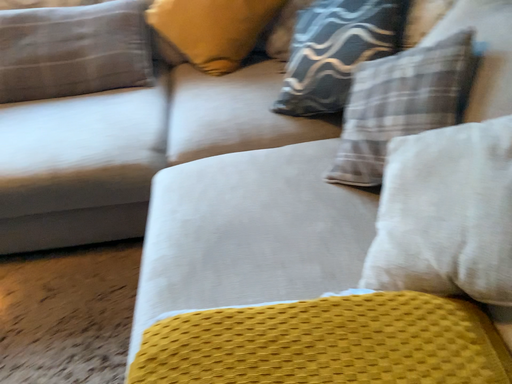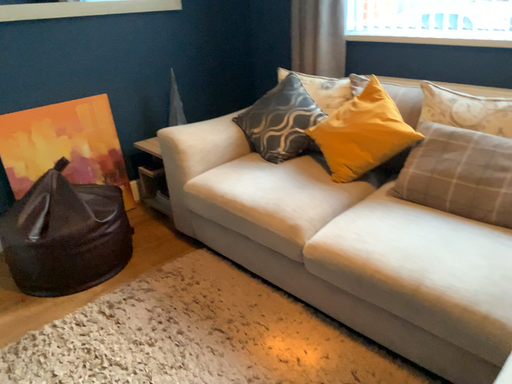
Question: Which way did the camera rotate in the video?

Choices:
 (A) rotated right
 (B) rotated left

Answer: (B)